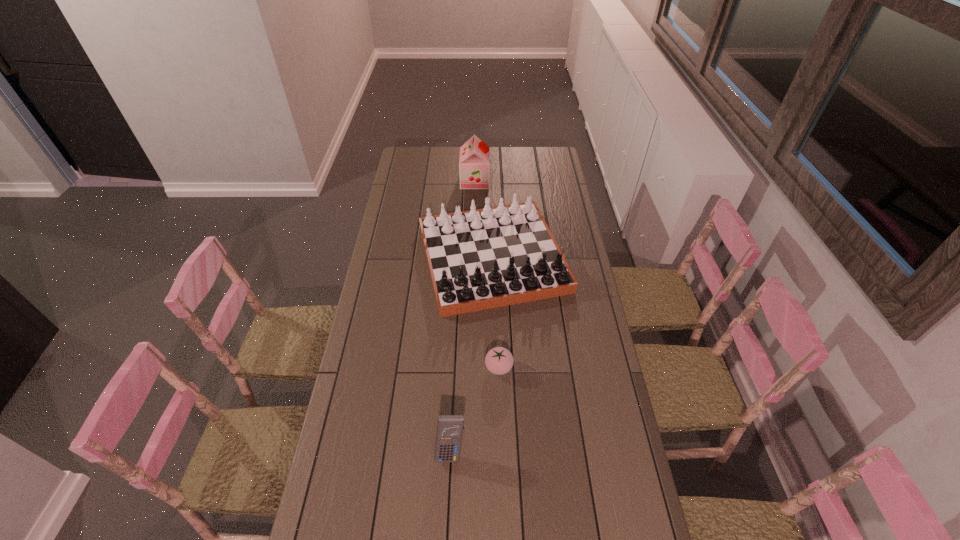
Locate an element on the screen. blank region between the calculator and the farthest object is located at coordinates (463, 315).

Image resolution: width=960 pixels, height=540 pixels. I want to click on object that stands as the second closest to the soya milk, so click(x=499, y=360).

Select which object appears as the closest to the gameboard. Please provide its 2D coordinates. Your answer should be formatted as a tuple, i.e. [(x, y)], where the tuple contains the x and y coordinates of a point satisfying the conditions above.

[(499, 360)]

Locate an element on the screen. This screenshot has height=540, width=960. free space that satisfies the following two spatial constraints: 1. with the cap open on the third farthest object; 2. on the right side of the farthest object is located at coordinates (472, 367).

Image resolution: width=960 pixels, height=540 pixels. Find the location of `free spot that satisfies the following two spatial constraints: 1. with the cap open on the farthest object; 2. on the front-facing side of the nearest object`. free spot that satisfies the following two spatial constraints: 1. with the cap open on the farthest object; 2. on the front-facing side of the nearest object is located at coordinates (470, 450).

Image resolution: width=960 pixels, height=540 pixels. Identify the location of vacant point that satisfies the following two spatial constraints: 1. with the cap open on the third nearest object; 2. on the right side of the farthest object. (473, 258).